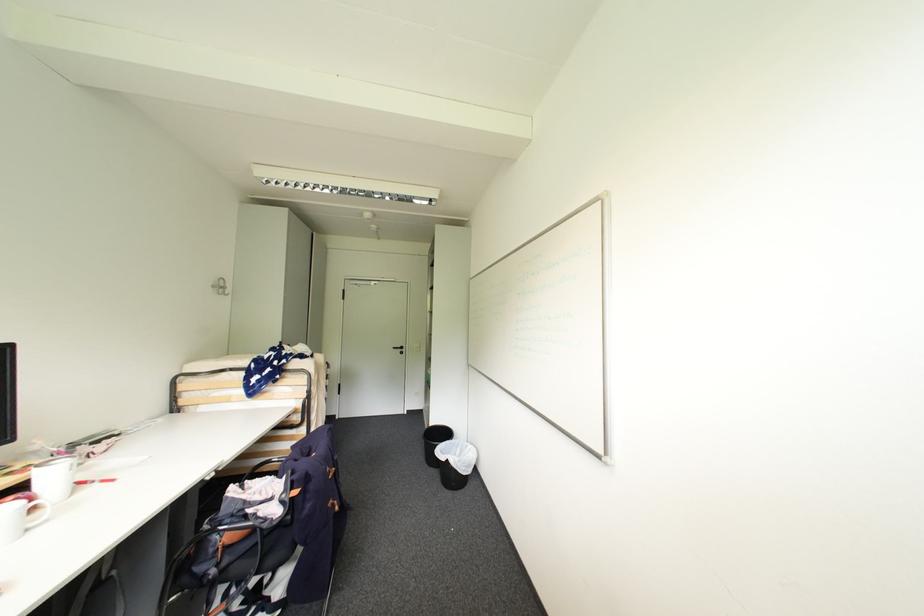
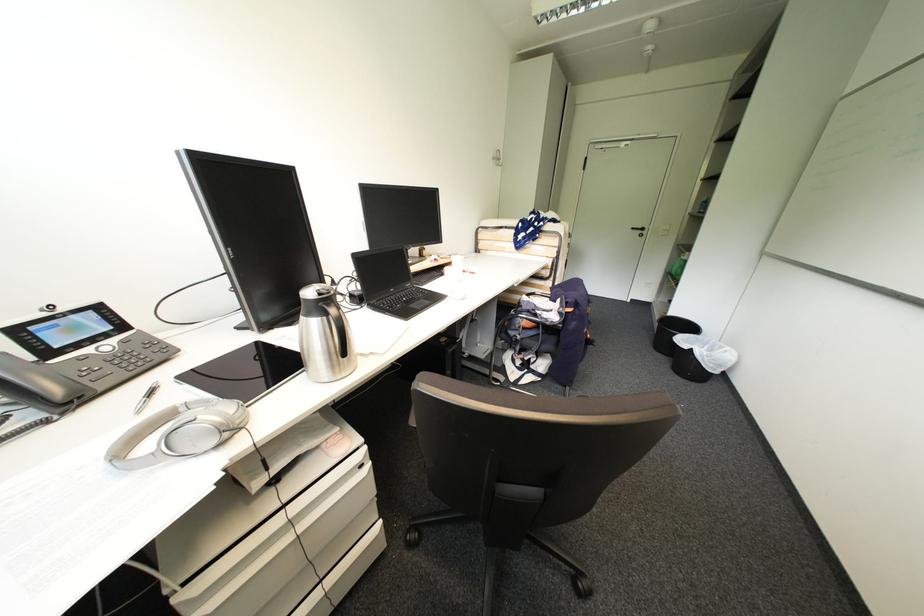
How did the camera likely rotate?

The rotation direction of the camera is left-down.